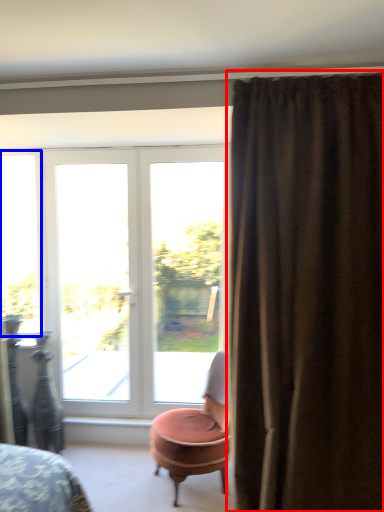
Question: Which object appears closest to the camera in this image, curtain (highlighted by a red box) or window (highlighted by a blue box)?

Choices:
 (A) curtain
 (B) window

Answer: (A)